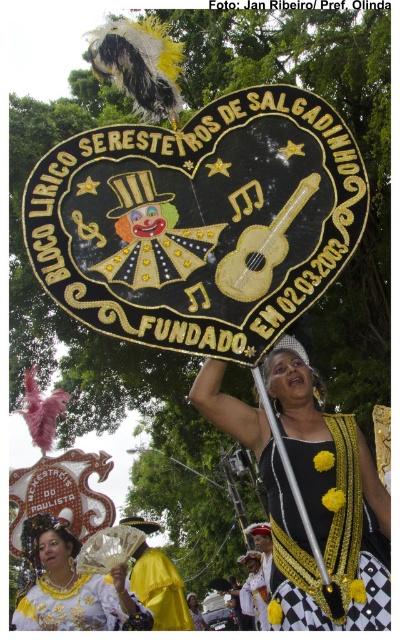
Based on the photo, you are a photographer trying to capture the entire scene of the BLOCO LIRICO SERESTEIROS DE SALGADINHO parade. You notice the white satin fan at lower left and the yellow satin cape at center. Which object should you focus on first to ensure both are in frame?

The white satin fan at lower left is bigger than the yellow satin cape at center, so you should focus on the white satin fan at lower left first to ensure both objects fit in the frame.

Consider the image. You are a photographer trying to capture the heart shaped sign in the parade. You notice two points marked on your camera screen at coordinates point (50, 552) and point (151, 593). Which point should you focus on to ensure the sign is sharp in your photo?

You should focus on point (50, 552) because it is closer to the viewer than point (151, 593), ensuring the sign appears sharp in the photo.